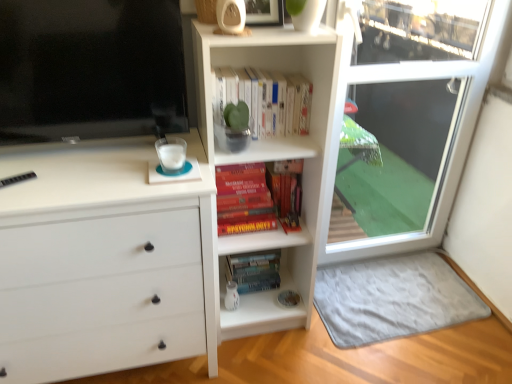
Question: Is white matte book at upper center, which ranks as the 1th book in top-to-bottom order, at the back of hardcover books at center, the second book viewed from the top?

Choices:
 (A) no
 (B) yes

Answer: (A)

Question: From the image's perspective, is hardcover books at center, acting as the first book starting from the bottom, located beneath white matte book at upper center, which ranks as the 1th book in top-to-bottom order?

Choices:
 (A) no
 (B) yes

Answer: (B)

Question: From a real-world perspective, is hardcover books at center, acting as the first book starting from the bottom, on top of white matte book at upper center, which ranks as the 1th book in top-to-bottom order?

Choices:
 (A) no
 (B) yes

Answer: (A)

Question: Is the depth of hardcover books at center, acting as the first book starting from the bottom, less than that of white matte book at upper center, which is counted as the second book, starting from the bottom?

Choices:
 (A) yes
 (B) no

Answer: (B)

Question: Is hardcover books at center, the second book viewed from the top, positioned far away from white matte book at upper center, which ranks as the 1th book in top-to-bottom order?

Choices:
 (A) yes
 (B) no

Answer: (B)

Question: Can you confirm if hardcover books at center, acting as the first book starting from the bottom, is smaller than white matte book at upper center, which is counted as the second book, starting from the bottom?

Choices:
 (A) yes
 (B) no

Answer: (B)

Question: Is white matte book at upper center, which is counted as the second book, starting from the bottom, thinner than hardcover books at center, acting as the first book starting from the bottom?

Choices:
 (A) no
 (B) yes

Answer: (B)

Question: Can you confirm if white matte book at upper center, which ranks as the 1th book in top-to-bottom order, is wider than hardcover books at center, the second book viewed from the top?

Choices:
 (A) no
 (B) yes

Answer: (A)

Question: Is white matte book at upper center, which ranks as the 1th book in top-to-bottom order, looking in the opposite direction of hardcover books at center, acting as the first book starting from the bottom?

Choices:
 (A) no
 (B) yes

Answer: (A)

Question: From a real-world perspective, is white matte book at upper center, which ranks as the 1th book in top-to-bottom order, located higher than hardcover books at center, the second book viewed from the top?

Choices:
 (A) no
 (B) yes

Answer: (B)

Question: Is there a large distance between white matte book at upper center, which is counted as the second book, starting from the bottom, and hardcover books at center, acting as the first book starting from the bottom?

Choices:
 (A) no
 (B) yes

Answer: (A)

Question: Would you say white matte book at upper center, which ranks as the 1th book in top-to-bottom order, is outside hardcover books at center, acting as the first book starting from the bottom?

Choices:
 (A) yes
 (B) no

Answer: (A)

Question: Is hardcover books at center, acting as the first book starting from the bottom, behind flat screen tv at upper left?

Choices:
 (A) yes
 (B) no

Answer: (A)